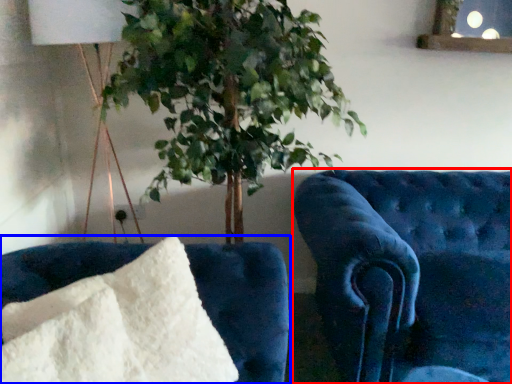
Question: Which object is closer to the camera taking this photo, furniture (highlighted by a red box) or furniture (highlighted by a blue box)?

Choices:
 (A) furniture
 (B) furniture

Answer: (B)